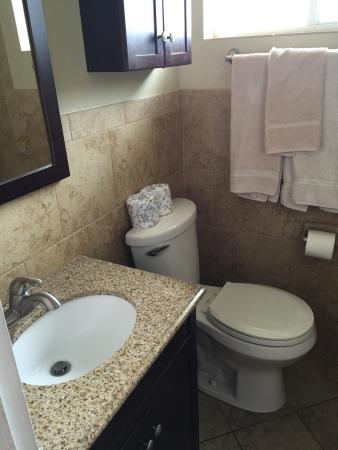
The image size is (338, 450). What are the coordinates of `faucet` in the screenshot? It's located at (35, 299).